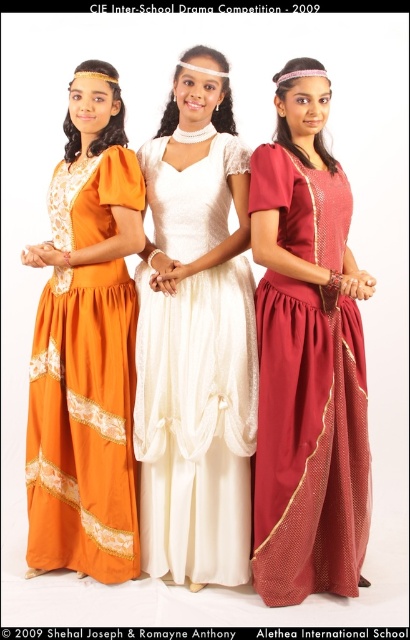
Question: Does white satin dress at center appear under orange lace dress at left?

Choices:
 (A) no
 (B) yes

Answer: (A)

Question: Which of the following is the closest to the observer?

Choices:
 (A) matte red dress at center
 (B) white satin dress at center

Answer: (A)

Question: Which point is closer to the camera?

Choices:
 (A) white satin dress at center
 (B) matte red dress at center

Answer: (B)

Question: Is matte red dress at center further to the viewer compared to orange lace dress at left?

Choices:
 (A) no
 (B) yes

Answer: (A)

Question: Observing the image, what is the correct spatial positioning of matte red dress at center in reference to white satin dress at center?

Choices:
 (A) right
 (B) left

Answer: (A)

Question: Which object appears farthest from the camera in this image?

Choices:
 (A) orange lace dress at left
 (B) white satin dress at center

Answer: (A)